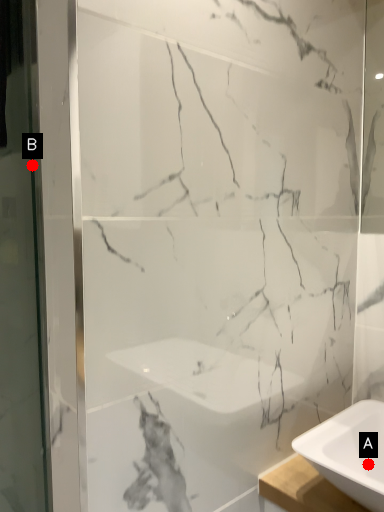
Question: Two points are circled on the image, labeled by A and B beside each circle. Which point appears closest to the camera in this image?

Choices:
 (A) A is closer
 (B) B is closer

Answer: (A)